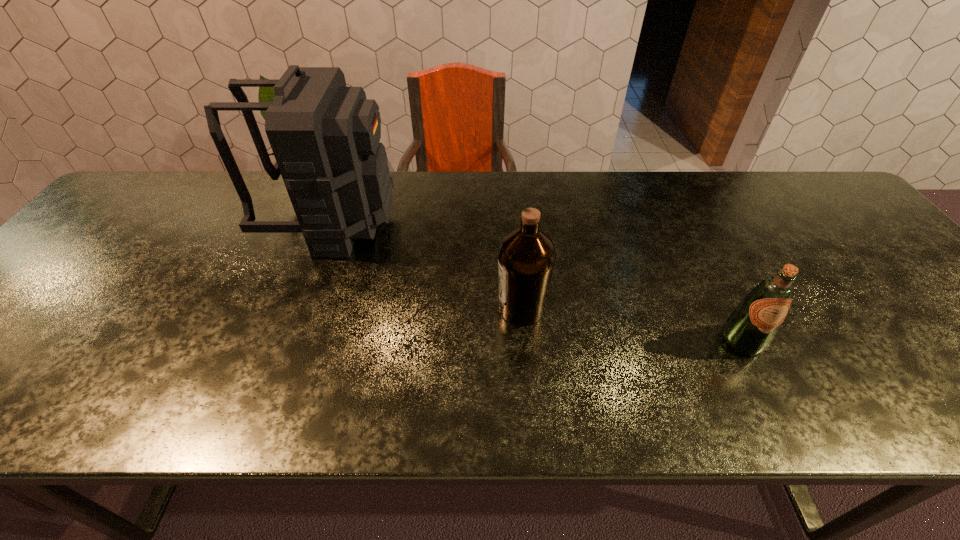
Locate an element on the screen. The width and height of the screenshot is (960, 540). vacant space in between the second tallest object and the shortest object is located at coordinates (632, 325).

Identify the location of blank region between the right olive oil and the second object from left to right. This screenshot has width=960, height=540. (632, 325).

The width and height of the screenshot is (960, 540). I want to click on blank region between the shorter olive oil and the taller olive oil, so click(632, 325).

Identify which object is located as the nearest to the second object from right to left. Please provide its 2D coordinates. Your answer should be formatted as a tuple, i.e. [(x, y)], where the tuple contains the x and y coordinates of a point satisfying the conditions above.

[(325, 136)]

In order to click on object that is the second closest to the shorter olive oil in this screenshot , I will do `click(325, 136)`.